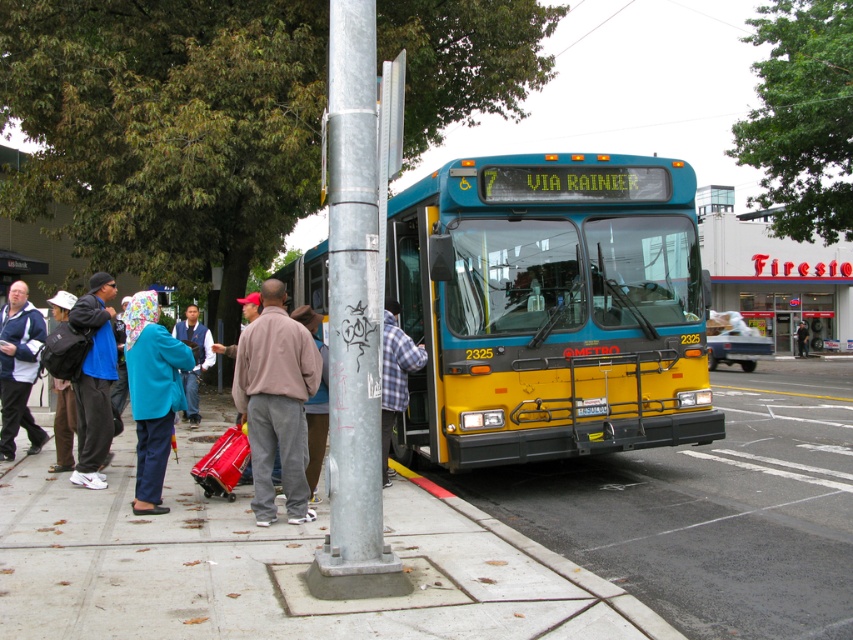
Between galvanized metal pole at center and light brown leather jacket at center, which one appears on the left side from the viewer's perspective?

galvanized metal pole at center is more to the left.

Which of these two, galvanized metal pole at center or light brown leather jacket at center, stands taller?

With more height is galvanized metal pole at center.

Locate an element on the screen. galvanized metal pole at center is located at coordinates (352, 321).

From the picture: Which is more to the left, blue fleece jacket at left or plaid fabric shirt at center?

blue fleece jacket at left is more to the left.

Is blue fleece jacket at left bigger than plaid fabric shirt at center?

Indeed, blue fleece jacket at left has a larger size compared to plaid fabric shirt at center.

Does point (108, 369) come in front of point (404, 355)?

That is False.

Identify the location of blue fleece jacket at left. The width and height of the screenshot is (853, 640). (94, 380).

Which is in front, point (390, 493) or point (86, 413)?

Point (86, 413) is more forward.

Who is positioned more to the left, concrete at center or blue fleece jacket at left?

From the viewer's perspective, blue fleece jacket at left appears more on the left side.

Between point (3, 589) and point (96, 410), which one is positioned in front?

Point (3, 589)

Identify the location of concrete at center. The width and height of the screenshot is (853, 640). (274, 563).